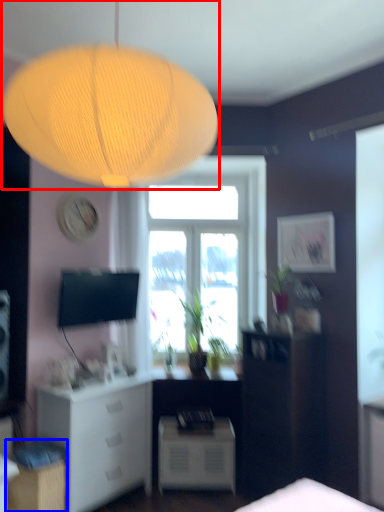
Question: Which object appears closest to the camera in this image, lamp (highlighted by a red box) or cabinetry (highlighted by a blue box)?

Choices:
 (A) lamp
 (B) cabinetry

Answer: (A)